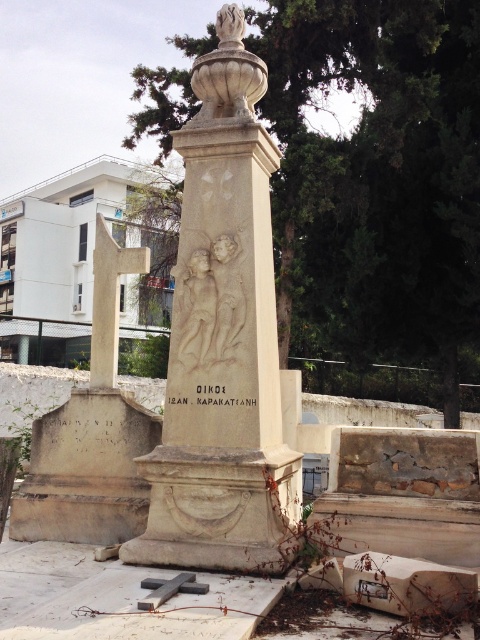
You are standing in front of the monument described in the scene. There is a point labeled as point (228, 291). What is located at this point?

At point (228, 291) lies the white stone relief at center.